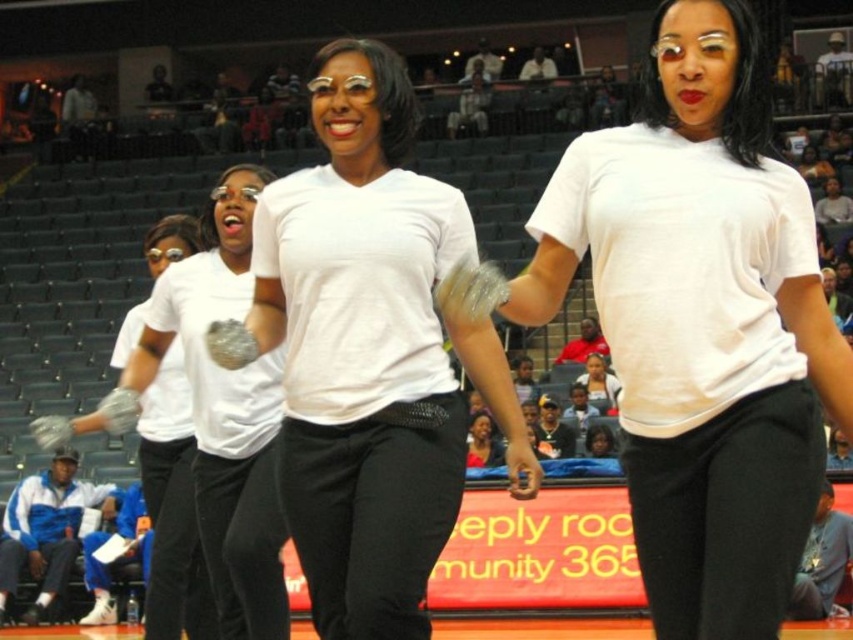
Question: Which object is the farthest from the white matte shirt at center?

Choices:
 (A) white matte gloves at center
 (B) white matte glove at center
 (C) white matte t-shirt at center

Answer: (C)

Question: Does white matte t-shirt at center appear on the right side of white matte shirt at center?

Choices:
 (A) yes
 (B) no

Answer: (A)

Question: Among these objects, which one is farthest from the camera?

Choices:
 (A) white matte t-shirt at center
 (B) white matte glove at center
 (C) white matte gloves at center
 (D) white matte shirt at center

Answer: (B)

Question: Is white matte glove at center bigger than white matte gloves at center?

Choices:
 (A) no
 (B) yes

Answer: (A)

Question: Which object is positioned closest to the white matte glove at center?

Choices:
 (A) white matte t-shirt at center
 (B) white matte shirt at center
 (C) white matte gloves at center

Answer: (C)

Question: Can you confirm if white matte t-shirt at center is wider than white matte glove at center?

Choices:
 (A) no
 (B) yes

Answer: (A)